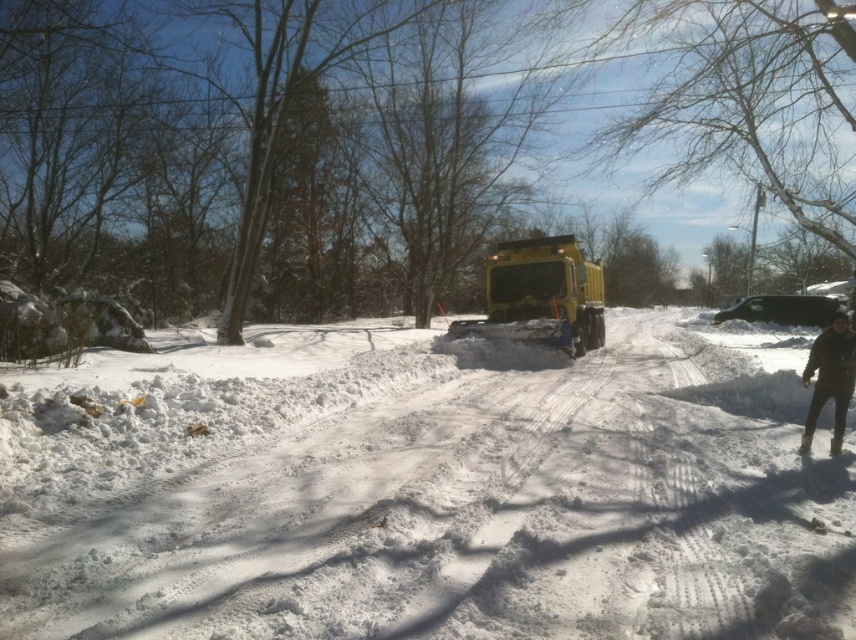
Can you confirm if yellow rubber snowplow at center is positioned above black glossy car at center?

Yes.

Does yellow rubber snowplow at center come behind black glossy car at center?

Yes, yellow rubber snowplow at center is further from the viewer.

Does point (544, 336) lie in front of point (819, 320)?

Yes, it is in front of point (819, 320).

This screenshot has width=856, height=640. Find the location of `yellow rubber snowplow at center`. yellow rubber snowplow at center is located at coordinates (541, 296).

Who is shorter, white fluffy snow at center or black glossy car at center?

With less height is white fluffy snow at center.

Identify the location of white fluffy snow at center. (438, 499).

Looking at this image, which is below, white fluffy snow at center or yellow rubber snowplow at center?

white fluffy snow at center is below.

Can you confirm if white fluffy snow at center is positioned above yellow rubber snowplow at center?

Actually, white fluffy snow at center is below yellow rubber snowplow at center.

Between point (431, 419) and point (581, 352), which one is positioned in front?

Point (431, 419) is in front.

The width and height of the screenshot is (856, 640). Identify the location of white fluffy snow at center. (438, 499).